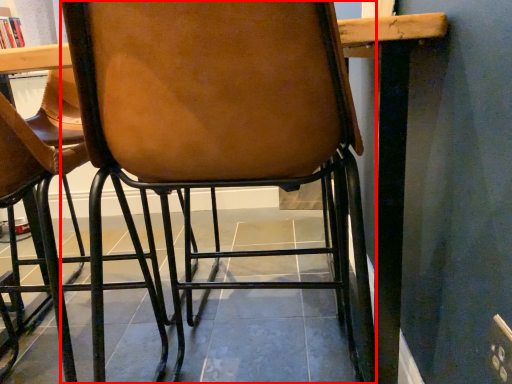
Question: From the image's perspective, what is the correct spatial relationship of chair (annotated by the red box) in relation to curtain?

Choices:
 (A) below
 (B) above

Answer: (A)